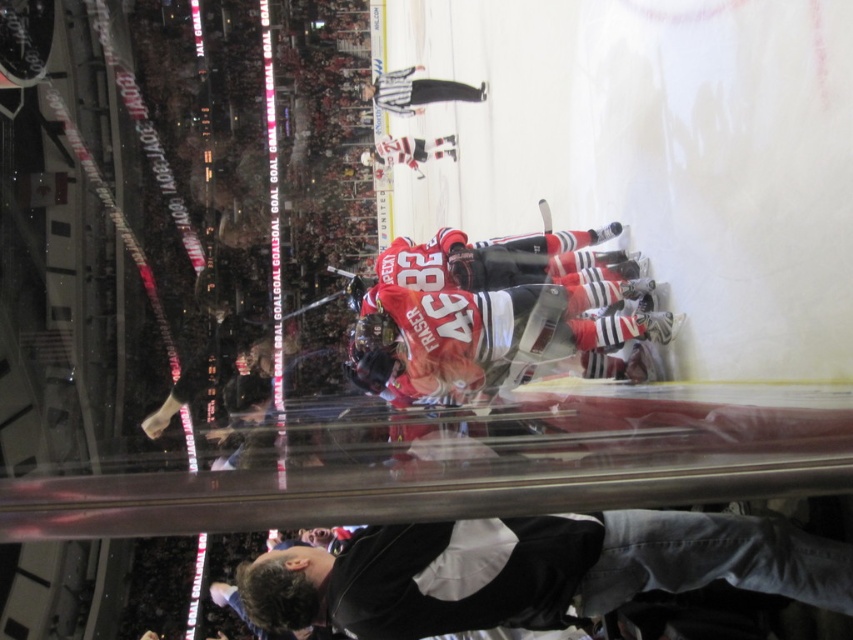
From the picture: You are a spectator sitting at point A. You notice two points marked in the scene. The first point is at coordinates point (500, 364) and the second point is at point (366, 93). Which point is closer to your current position?

Point (500, 364) is in front of point (366, 93), so it is closer to your current position.

You are a spectator at the ice hockey game and want to take a photo of both the dark gray jacket at lower center and the black uniform at upper center in the same frame. Given that your camera has a maximum zoom range of 25 meters, will you be able to capture both objects in one shot?

The dark gray jacket at lower center and the black uniform at upper center are 26.21 meters apart from each other. Since the distance exceeds the camera maximum zoom range of 25 meters, you cannot capture both objects in one shot.

You are an ice hockey coach standing at the edge of the rink. You want to move from the matte red jersey at center to the black uniform at upper center during a timeout. Can you walk directly between them without stepping over the blue lines? Please explain your reasoning.

The distance between the matte red jersey at center and the black uniform at upper center is 18.59 meters. The standard distance between blue lines on an ice hockey rink is 25 meters. Since 18.59 meters is less than 25 meters, you can walk directly between them without crossing the blue lines.